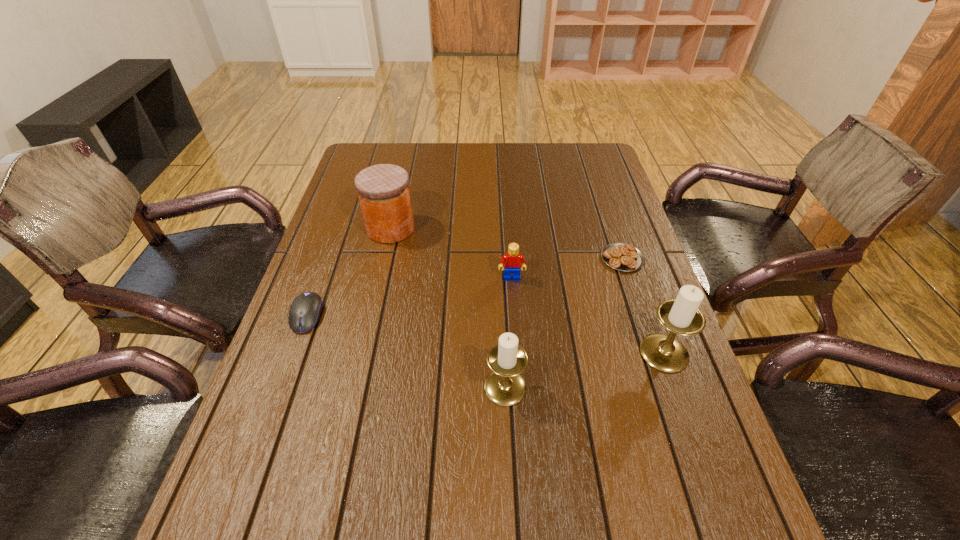
Where is `free spot between the Lego and the shorter candle holder`? This screenshot has width=960, height=540. free spot between the Lego and the shorter candle holder is located at coordinates (509, 333).

I want to click on vacant space in between the left candle holder and the jar, so click(x=448, y=308).

The image size is (960, 540). Identify the location of free point between the third farthest object and the shorter candle holder. (509, 333).

At what (x,y) coordinates should I click in order to perform the action: click on vacant area between the farthest object and the fourth tallest object. Please return your answer as a coordinate pair (x, y). This screenshot has width=960, height=540. Looking at the image, I should click on (451, 253).

Find the location of a particular element. free spot between the pastry and the taller candle holder is located at coordinates (643, 306).

Locate an element on the screen. Image resolution: width=960 pixels, height=540 pixels. the fifth closest object to the left candle holder is located at coordinates (383, 190).

Identify which object is located as the second nearest to the second object from left to right. Please provide its 2D coordinates. Your answer should be formatted as a tuple, i.e. [(x, y)], where the tuple contains the x and y coordinates of a point satisfying the conditions above.

[(511, 261)]

Where is `free location that satisfies the following two spatial constraints: 1. on the back side of the computer mouse; 2. on the left side of the fifth object from right to left`? The image size is (960, 540). free location that satisfies the following two spatial constraints: 1. on the back side of the computer mouse; 2. on the left side of the fifth object from right to left is located at coordinates (338, 228).